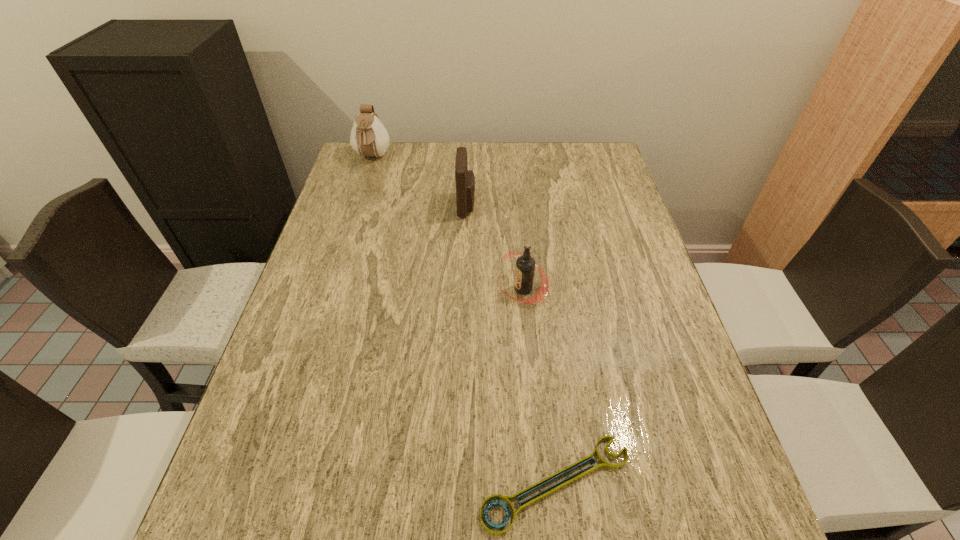
Locate an element on the screen. The width and height of the screenshot is (960, 540). the farthest object is located at coordinates (369, 138).

Where is `the left pouch`? The image size is (960, 540). the left pouch is located at coordinates (369, 138).

Where is `the second farthest object`? Image resolution: width=960 pixels, height=540 pixels. the second farthest object is located at coordinates (465, 180).

In order to click on the third object from right to left in this screenshot , I will do `click(465, 180)`.

Find the location of a particular element. This screenshot has height=540, width=960. the second nearest object is located at coordinates (525, 265).

This screenshot has height=540, width=960. In order to click on the nearest object in this screenshot , I will do `click(580, 474)`.

Image resolution: width=960 pixels, height=540 pixels. What are the coordinates of `wrench` in the screenshot? It's located at (580, 474).

Find the location of `free region located on the front-facing side of the left pouch`. free region located on the front-facing side of the left pouch is located at coordinates (361, 193).

Where is `blank space located 0.160m with an open flap on the nearer pouch`? blank space located 0.160m with an open flap on the nearer pouch is located at coordinates 529,205.

Identify the location of free point located 0.380m on the label of the root beer. The image size is (960, 540). (344, 288).